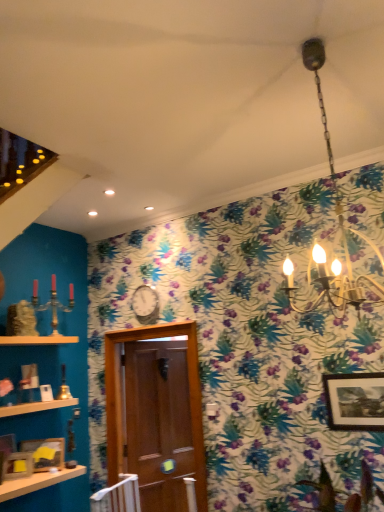
Question: Considering the relative positions of wooden photo frame at lower left, positioned as the third picture frame in right-to-left order, and wooden picture frame at lower left, positioned as the 2th picture frame in right-to-left order, in the image provided, is wooden photo frame at lower left, positioned as the third picture frame in right-to-left order, to the right of wooden picture frame at lower left, positioned as the 2th picture frame in right-to-left order, from the viewer's perspective?

Choices:
 (A) yes
 (B) no

Answer: (B)

Question: Does wooden photo frame at lower left, positioned as the 2th picture frame in left-to-right order, turn towards wooden picture frame at lower left, positioned as the 2th picture frame in right-to-left order?

Choices:
 (A) no
 (B) yes

Answer: (A)

Question: From a real-world perspective, is wooden photo frame at lower left, positioned as the 2th picture frame in left-to-right order, over wooden picture frame at lower left, positioned as the 2th picture frame in right-to-left order?

Choices:
 (A) no
 (B) yes

Answer: (A)

Question: From a real-world perspective, is wooden photo frame at lower left, positioned as the 2th picture frame in left-to-right order, positioned under wooden picture frame at lower left, positioned as the 2th picture frame in right-to-left order, based on gravity?

Choices:
 (A) no
 (B) yes

Answer: (B)

Question: From the image's perspective, is wooden photo frame at lower left, positioned as the 2th picture frame in left-to-right order, under wooden picture frame at lower left, positioned as the 2th picture frame in right-to-left order?

Choices:
 (A) yes
 (B) no

Answer: (B)

Question: Is wooden photo frame at lower left, positioned as the third picture frame in right-to-left order, inside or outside of wooden shelf at lower left, the 2th shelf when ordered from top to bottom?

Choices:
 (A) inside
 (B) outside

Answer: (B)

Question: Is point (29, 474) positioned closer to the camera than point (19, 413)?

Choices:
 (A) closer
 (B) farther

Answer: (A)

Question: Looking at the image, does wooden photo frame at lower left, positioned as the 2th picture frame in left-to-right order, seem bigger or smaller compared to wooden shelf at lower left, the 2th shelf when ordered from top to bottom?

Choices:
 (A) big
 (B) small

Answer: (B)

Question: Considering their positions, is wooden photo frame at lower left, positioned as the third picture frame in right-to-left order, located in front of or behind wooden shelf at lower left, marked as the 1th shelf in a bottom-to-top arrangement?

Choices:
 (A) front
 (B) behind

Answer: (B)

Question: Considering the positions of gold metallic chandelier at upper center and brown wooden door at center in the image, is gold metallic chandelier at upper center taller or shorter than brown wooden door at center?

Choices:
 (A) short
 (B) tall

Answer: (A)

Question: Considering the positions of point (304, 47) and point (145, 462), is point (304, 47) closer or farther from the camera than point (145, 462)?

Choices:
 (A) closer
 (B) farther

Answer: (A)

Question: Would you say gold metallic chandelier at upper center is to the left or to the right of brown wooden door at center in the picture?

Choices:
 (A) right
 (B) left

Answer: (A)

Question: Relative to brown wooden door at center, is gold metallic chandelier at upper center in front or behind?

Choices:
 (A) behind
 (B) front

Answer: (B)

Question: Is wooden picture frame at upper right, arranged as the fourth picture frame when viewed from the left, in front of or behind wooden picture frame at lower left, positioned as the 2th picture frame in right-to-left order, in the image?

Choices:
 (A) front
 (B) behind

Answer: (A)

Question: Is wooden picture frame at upper right, the 1th picture frame positioned from the right, inside or outside of wooden picture frame at lower left, which ranks as the third picture frame in left-to-right order?

Choices:
 (A) inside
 (B) outside

Answer: (B)